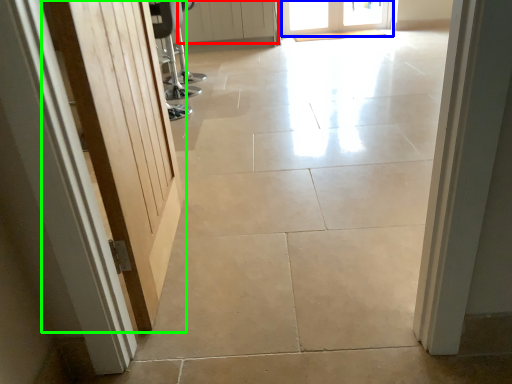
Question: Which object is the farthest from door (highlighted by a red box)? Choose among these: door (highlighted by a blue box) or door (highlighted by a green box).

Choices:
 (A) door
 (B) door

Answer: (B)